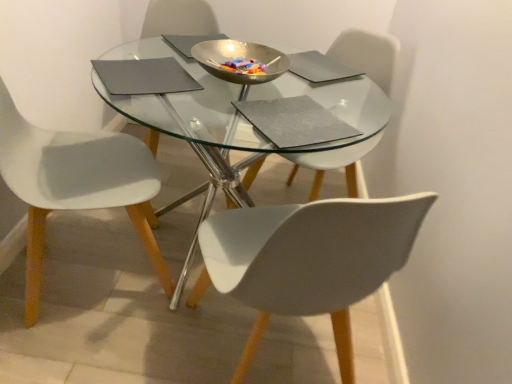
Question: From a real-world perspective, is metallic gold bowl at center positioned under transparent glass table at center based on gravity?

Choices:
 (A) no
 (B) yes

Answer: (A)

Question: Is metallic gold bowl at center turned away from transparent glass table at center?

Choices:
 (A) no
 (B) yes

Answer: (A)

Question: Does metallic gold bowl at center have a lesser height compared to transparent glass table at center?

Choices:
 (A) no
 (B) yes

Answer: (B)

Question: From the image's perspective, does metallic gold bowl at center appear lower than transparent glass table at center?

Choices:
 (A) yes
 (B) no

Answer: (B)

Question: From a real-world perspective, is metallic gold bowl at center physically above transparent glass table at center?

Choices:
 (A) no
 (B) yes

Answer: (B)

Question: Considering the positions of metallic gold bowl at center and white plastic chair at lower right, the 2th chair viewed from the left, in the image, is metallic gold bowl at center taller or shorter than white plastic chair at lower right, the 2th chair viewed from the left,?

Choices:
 (A) tall
 (B) short

Answer: (B)

Question: In terms of size, does metallic gold bowl at center appear bigger or smaller than white plastic chair at lower right, which is the second chair in right-to-left order?

Choices:
 (A) small
 (B) big

Answer: (A)

Question: From the image's perspective, is metallic gold bowl at center located above or below white plastic chair at lower right, which is the second chair in right-to-left order?

Choices:
 (A) below
 (B) above

Answer: (B)

Question: Does point (220, 52) appear closer or farther from the camera than point (313, 254)?

Choices:
 (A) farther
 (B) closer

Answer: (A)

Question: From the image's perspective, is white plastic chair at lower right, the 2th chair viewed from the left, positioned above or below transparent glass table at center?

Choices:
 (A) above
 (B) below

Answer: (B)

Question: Which is correct: white plastic chair at lower right, which is the second chair in right-to-left order, is inside transparent glass table at center, or outside of it?

Choices:
 (A) inside
 (B) outside

Answer: (A)

Question: In terms of width, does white plastic chair at lower right, the 2th chair viewed from the left, look wider or thinner when compared to transparent glass table at center?

Choices:
 (A) thin
 (B) wide

Answer: (A)

Question: In terms of size, does white plastic chair at lower right, which is the second chair in right-to-left order, appear bigger or smaller than transparent glass table at center?

Choices:
 (A) small
 (B) big

Answer: (A)

Question: In the image, is white plastic chair at lower right, the 2th chair viewed from the left, positioned in front of or behind transparent glass bowl at center?

Choices:
 (A) behind
 (B) front

Answer: (B)

Question: Looking at the image, does white plastic chair at lower right, which is the second chair in right-to-left order, seem bigger or smaller compared to transparent glass bowl at center?

Choices:
 (A) small
 (B) big

Answer: (A)